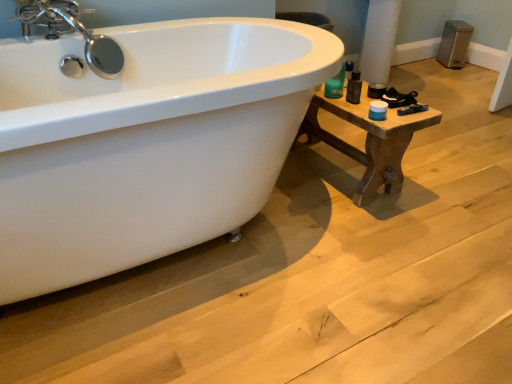
Question: Considering the relative sizes of matte black container at right and brown wooden table at right in the image provided, is matte black container at right smaller than brown wooden table at right?

Choices:
 (A) no
 (B) yes

Answer: (B)

Question: Is the position of matte black container at right less distant than that of brown wooden table at right?

Choices:
 (A) yes
 (B) no

Answer: (B)

Question: Does matte black container at right have a larger size compared to brown wooden table at right?

Choices:
 (A) yes
 (B) no

Answer: (B)

Question: Is matte black container at right oriented towards brown wooden table at right?

Choices:
 (A) yes
 (B) no

Answer: (B)

Question: Can you confirm if matte black container at right is taller than brown wooden table at right?

Choices:
 (A) yes
 (B) no

Answer: (B)

Question: Considering the positions of brown wooden table at right and chrome/metallic faucet at upper left in the image, is brown wooden table at right wider or thinner than chrome/metallic faucet at upper left?

Choices:
 (A) wide
 (B) thin

Answer: (A)

Question: From a real-world perspective, is brown wooden table at right positioned above or below chrome/metallic faucet at upper left?

Choices:
 (A) above
 (B) below

Answer: (B)

Question: Is point (394, 135) closer or farther from the camera than point (53, 6)?

Choices:
 (A) farther
 (B) closer

Answer: (B)

Question: Is brown wooden table at right taller or shorter than chrome/metallic faucet at upper left?

Choices:
 (A) tall
 (B) short

Answer: (A)

Question: Which is correct: matte black container at right is inside chrome/metallic faucet at upper left, or outside of it?

Choices:
 (A) outside
 (B) inside

Answer: (A)

Question: Visually, is matte black container at right positioned to the left or to the right of chrome/metallic faucet at upper left?

Choices:
 (A) right
 (B) left

Answer: (A)

Question: From the image's perspective, is matte black container at right above or below chrome/metallic faucet at upper left?

Choices:
 (A) below
 (B) above

Answer: (A)

Question: From their relative heights in the image, would you say matte black container at right is taller or shorter than chrome/metallic faucet at upper left?

Choices:
 (A) short
 (B) tall

Answer: (A)

Question: Is chrome/metallic faucet at upper left situated inside brown wooden table at right or outside?

Choices:
 (A) outside
 (B) inside

Answer: (A)

Question: From the image's perspective, is chrome/metallic faucet at upper left positioned above or below brown wooden table at right?

Choices:
 (A) below
 (B) above

Answer: (B)